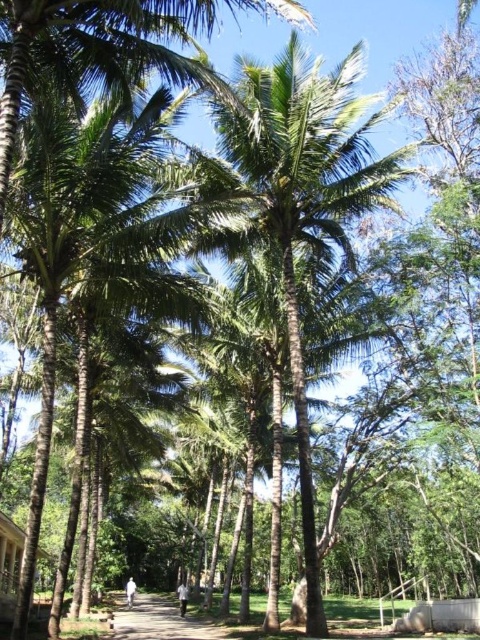
Question: Does brown dirt path at center appear on the left side of wooden hut at lower left?

Choices:
 (A) yes
 (B) no

Answer: (B)

Question: Is brown dirt path at center thinner than wooden hut at lower left?

Choices:
 (A) no
 (B) yes

Answer: (A)

Question: Is brown dirt path at center thinner than wooden hut at lower left?

Choices:
 (A) no
 (B) yes

Answer: (A)

Question: Which point is farther to the camera?

Choices:
 (A) green leafy coconut tree at center
 (B) brown dirt path at center
 (C) wooden hut at lower left

Answer: (C)

Question: Which of these objects is positioned farthest from the green leafy coconut tree at center?

Choices:
 (A) brown dirt path at center
 (B) wooden hut at lower left

Answer: (A)

Question: Which of the following is the closest to the observer?

Choices:
 (A) (231, 193)
 (B) (164, 616)
 (C) (3, 608)

Answer: (A)